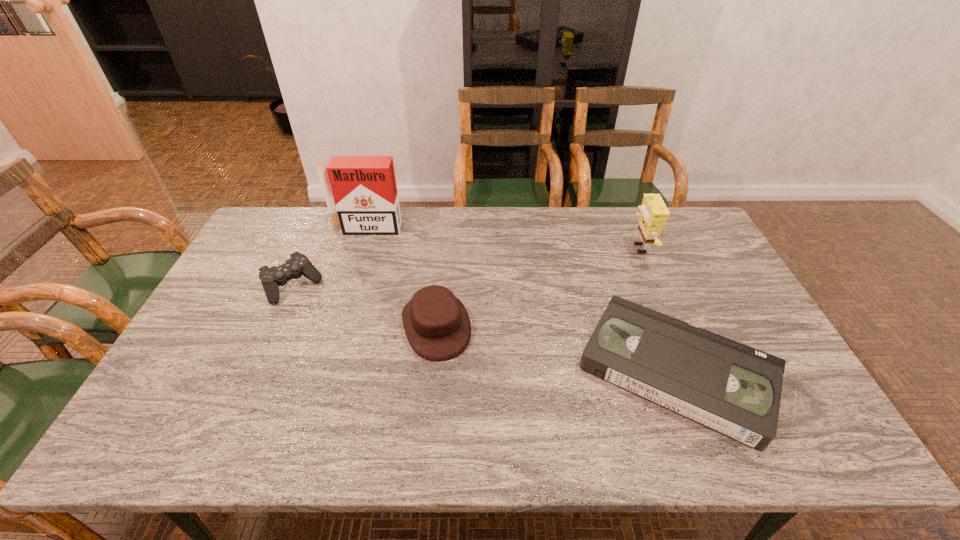
Image resolution: width=960 pixels, height=540 pixels. Identify the location of the tallest object. (364, 189).

I want to click on the second tallest object, so click(654, 213).

Locate an element on the screen. The width and height of the screenshot is (960, 540). hat is located at coordinates (437, 325).

The width and height of the screenshot is (960, 540). In order to click on the second shortest object in this screenshot , I will do `click(298, 265)`.

This screenshot has height=540, width=960. I want to click on videotape, so click(731, 388).

Find the location of a particular element. The image size is (960, 540). free region located 0.280m on the front-facing side of the tallest object is located at coordinates (346, 292).

The width and height of the screenshot is (960, 540). Find the location of `free space located 0.370m on the front-facing side of the sponge`. free space located 0.370m on the front-facing side of the sponge is located at coordinates (516, 248).

Where is `vacant space located on the front-facing side of the sponge`? Image resolution: width=960 pixels, height=540 pixels. vacant space located on the front-facing side of the sponge is located at coordinates (593, 248).

The image size is (960, 540). Identify the location of free space located on the front-facing side of the sponge. (511, 248).

Locate an element on the screen. Image resolution: width=960 pixels, height=540 pixels. blank space located on the front of the hat is located at coordinates (428, 414).